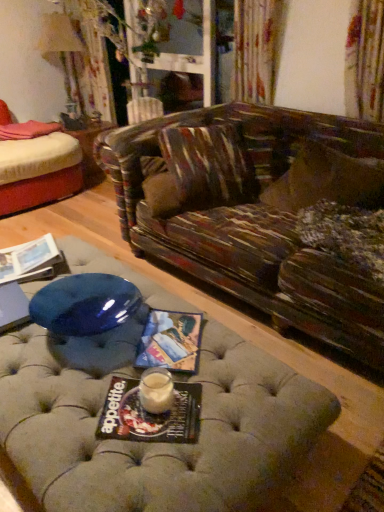
Locate an element on the screen. The height and width of the screenshot is (512, 384). vacant region under matte cream lampshade at upper left (from a real-world perspective) is located at coordinates (84, 123).